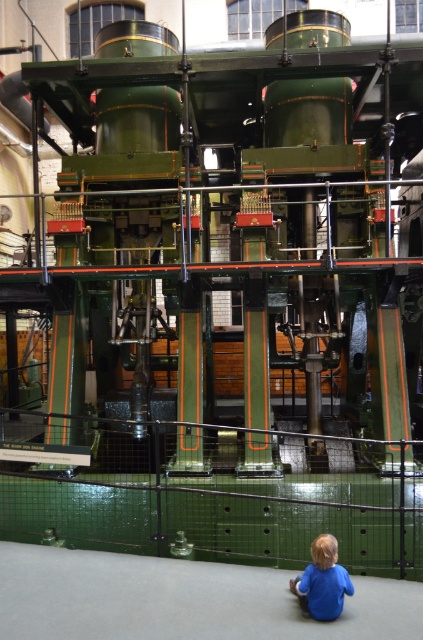
What do you see at coordinates (238, 236) in the screenshot? The height and width of the screenshot is (640, 423). I see `green polished metal steam engine at center` at bounding box center [238, 236].

Does green polished metal steam engine at center have a greater width compared to blue matte shirt at lower center?

No.

The height and width of the screenshot is (640, 423). Find the location of `green polished metal steam engine at center`. green polished metal steam engine at center is located at coordinates (238, 236).